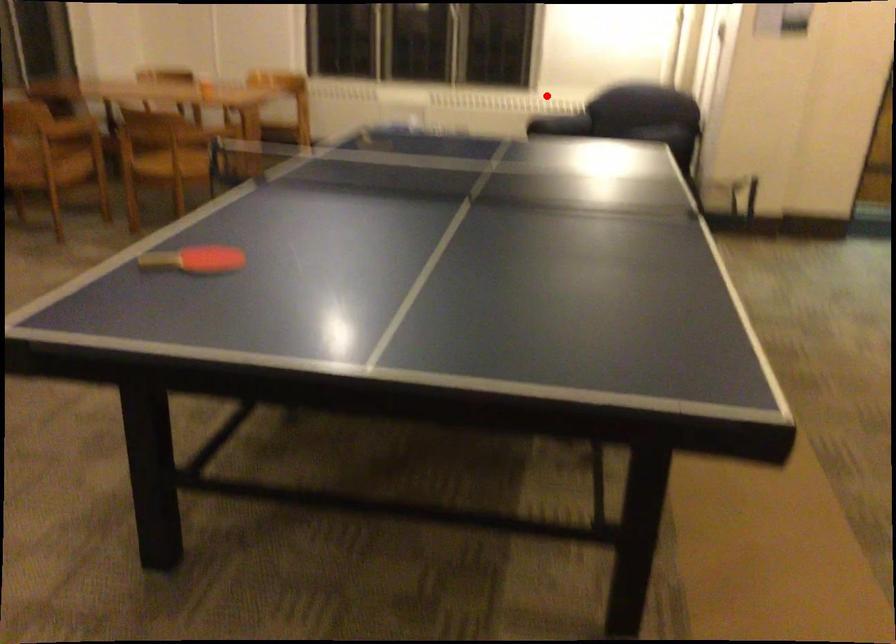
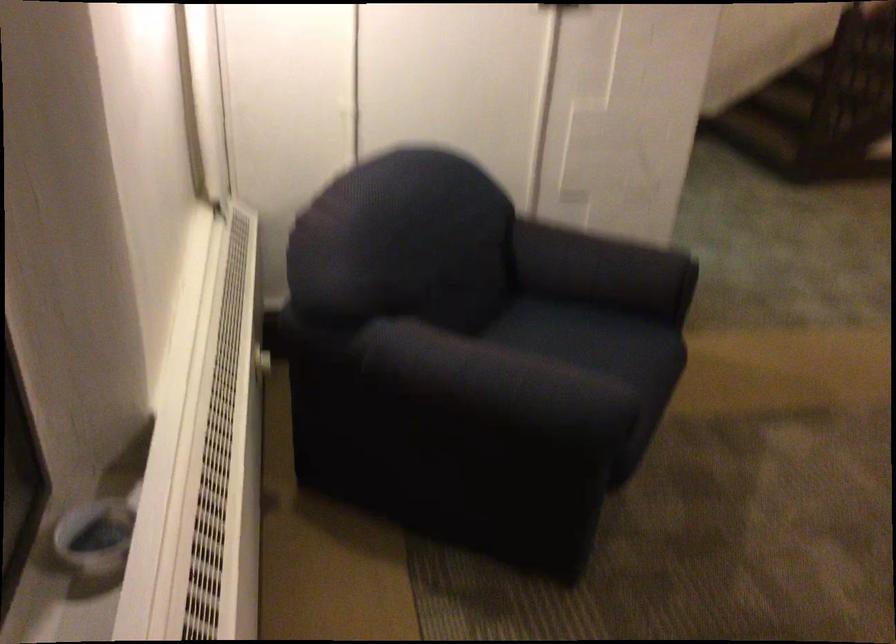
Question: I am providing you with two images of the same scene from different viewpoints. In image1, a red point is highlighted. Considering the same 3D point in image2, which of the following is correct?

Choices:
 (A) It is closer
 (B) It is farther

Answer: (A)